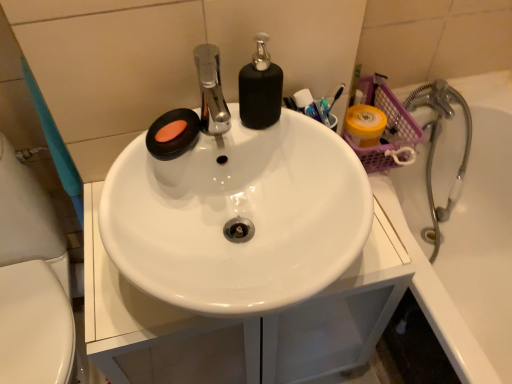
Question: From a real-world perspective, is white glossy sink at left located higher than white glossy sink at center?

Choices:
 (A) yes
 (B) no

Answer: (B)

Question: Is white glossy sink at left smaller than white glossy sink at center?

Choices:
 (A) yes
 (B) no

Answer: (B)

Question: Would you consider white glossy sink at left to be distant from white glossy sink at center?

Choices:
 (A) yes
 (B) no

Answer: (B)

Question: From a real-world perspective, is white glossy sink at left below white glossy sink at center?

Choices:
 (A) yes
 (B) no

Answer: (A)

Question: Is white glossy sink at left aimed at white glossy sink at center?

Choices:
 (A) yes
 (B) no

Answer: (B)

Question: Does white glossy sink at left have a lesser height compared to white glossy sink at center?

Choices:
 (A) yes
 (B) no

Answer: (B)

Question: Can you confirm if white glossy sink at center is smaller than matte black soap at upper left?

Choices:
 (A) no
 (B) yes

Answer: (A)

Question: Is white glossy sink at center with matte black soap at upper left?

Choices:
 (A) no
 (B) yes

Answer: (A)

Question: Is white glossy sink at center wider than matte black soap at upper left?

Choices:
 (A) no
 (B) yes

Answer: (B)

Question: From the image's perspective, is white glossy sink at center beneath matte black soap at upper left?

Choices:
 (A) yes
 (B) no

Answer: (A)

Question: Considering the relative sizes of white glossy sink at center and matte black soap at upper left in the image provided, is white glossy sink at center taller than matte black soap at upper left?

Choices:
 (A) yes
 (B) no

Answer: (A)

Question: Is white glossy sink at center far away from matte black soap at upper left?

Choices:
 (A) yes
 (B) no

Answer: (B)

Question: Is black matte soap dispenser at center oriented away from metallic silver faucet at right?

Choices:
 (A) yes
 (B) no

Answer: (B)